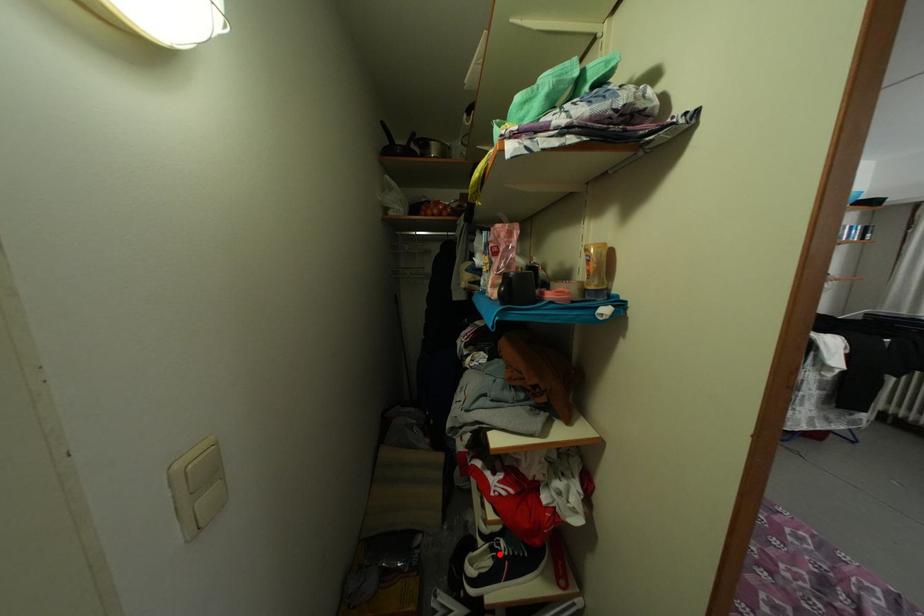
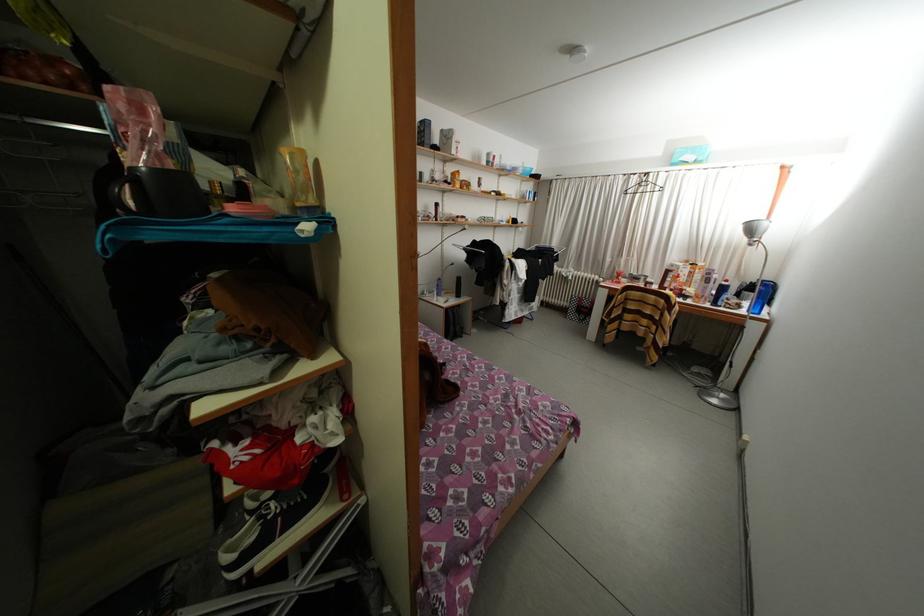
Question: A red point is marked in image1. In image2, is the corresponding 3D point closer to the camera or farther? Reply with the corresponding letter.

Choices:
 (A) The corresponding 3D point is closer.
 (B) The corresponding 3D point is farther.

Answer: (A)